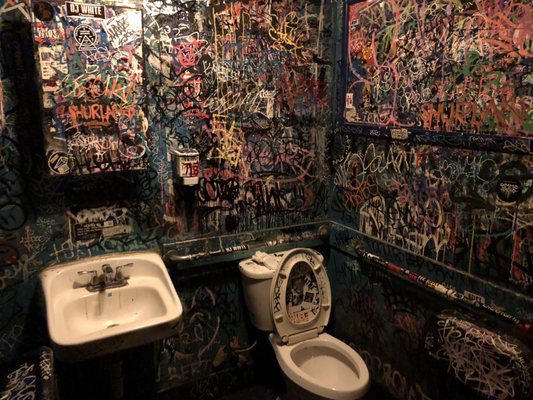
In order to click on side of toilet bowl rim, left side in this screenshot , I will do `click(292, 373)`.